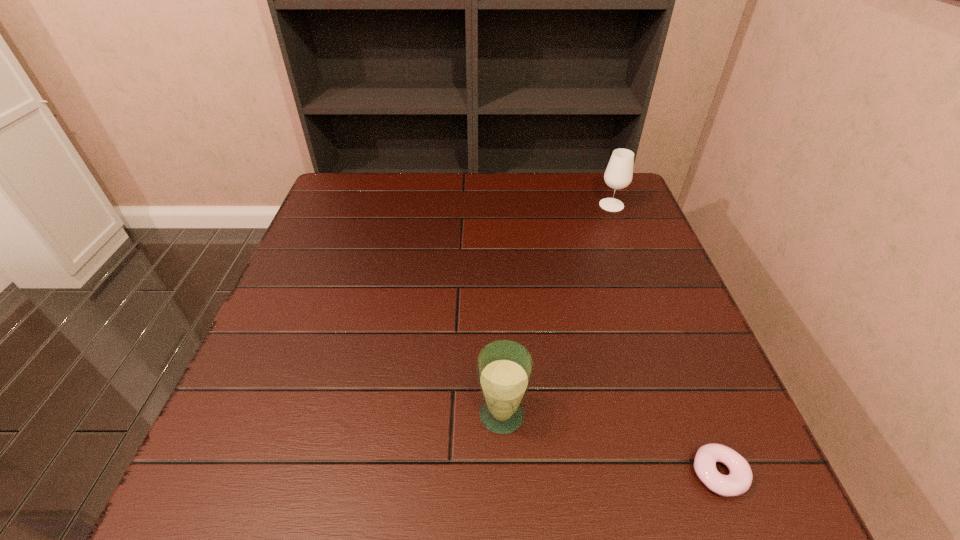
This screenshot has width=960, height=540. What are the coordinates of `object present at the near edge` in the screenshot? It's located at (738, 481).

Identify the location of glass that is at the right edge. This screenshot has height=540, width=960. (618, 175).

Find the location of a particular element. The image size is (960, 540). doughnut at the right edge is located at coordinates (738, 481).

Find the location of a particular element. The width and height of the screenshot is (960, 540). object that is at the far right corner is located at coordinates (618, 175).

At what (x,y) coordinates should I click in order to perform the action: click on object that is at the near right corner. Please return your answer as a coordinate pair (x, y). Looking at the image, I should click on (738, 481).

Locate an element on the screen. free space at the far edge is located at coordinates (413, 180).

You are a GUI agent. You are given a task and a screenshot of the screen. Output one action in this format:
    pyautogui.click(x=<x>, y=<y>)
    Task: Click on the free point at the near edge
    This screenshot has height=540, width=960.
    Given the screenshot: What is the action you would take?
    pyautogui.click(x=531, y=470)

In order to click on vacant region at the left edge in this screenshot , I will do `click(345, 277)`.

In order to click on vacant region at the right edge of the desktop in this screenshot , I will do [x=660, y=279].

At what (x,y) coordinates should I click in order to perform the action: click on vacant area at the near left corner of the desktop. Please return your answer as a coordinate pair (x, y). Looking at the image, I should click on click(285, 470).